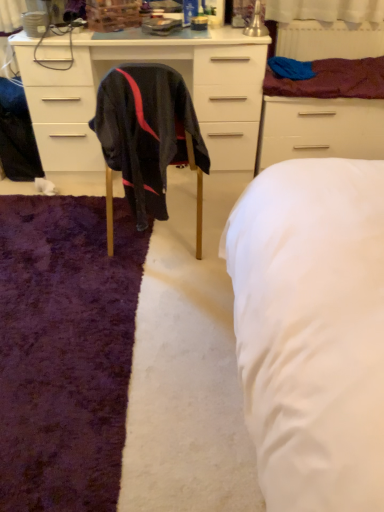
Question: From the image's perspective, relative to matte black cabinet at center, is black fabric chair at center above or below?

Choices:
 (A) above
 (B) below

Answer: (B)

Question: From a real-world perspective, is black fabric chair at center above or below matte black cabinet at center?

Choices:
 (A) above
 (B) below

Answer: (A)

Question: Considering the real-world distances, which object is farthest from the purple shaggy rug at lower left?

Choices:
 (A) white painted radiator at upper right
 (B) matte black cabinet at center
 (C) white matte drawer at upper right
 (D) maroon fabric at upper right
 (E) black fabric chair at center

Answer: (A)

Question: Estimate the real-world distances between objects in this image. Which object is closer to the black fabric chair at center?

Choices:
 (A) maroon fabric at upper right
 (B) purple shaggy rug at lower left
 (C) white matte drawer at upper right
 (D) white painted radiator at upper right
 (E) matte black cabinet at center

Answer: (B)